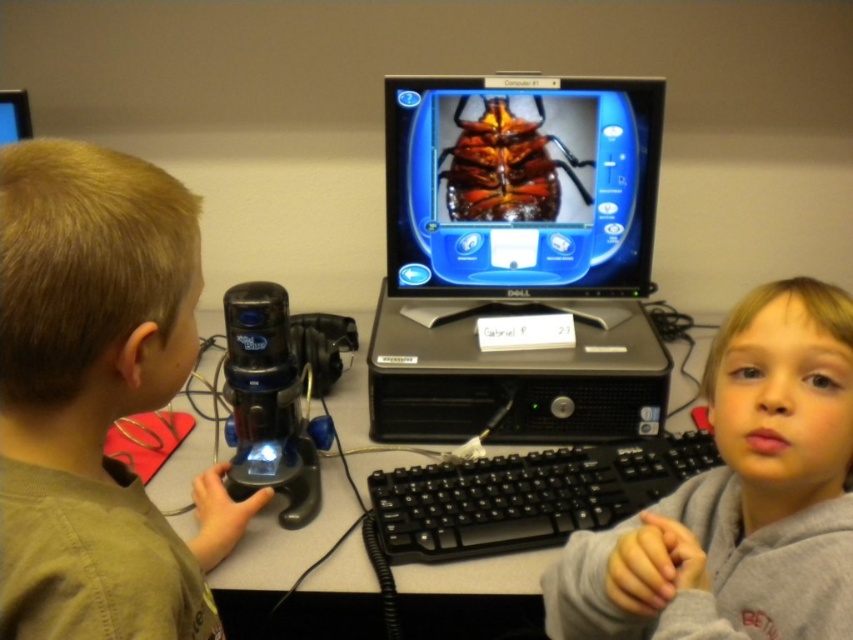
Is point (431, 300) positioned in front of point (444, 497)?

No, it is behind (444, 497).

Is black plastic desktop computer at center above black plastic keyboard at center?

Yes.

This screenshot has height=640, width=853. What do you see at coordinates (518, 257) in the screenshot? I see `black plastic desktop computer at center` at bounding box center [518, 257].

Where is `black plastic desktop computer at center`? black plastic desktop computer at center is located at coordinates (518, 257).

Can you confirm if black plastic keyboard at center is wider than black plastic computer desk at center?

In fact, black plastic keyboard at center might be narrower than black plastic computer desk at center.

Does point (482, 486) lie behind point (694, 397)?

No, (482, 486) is closer to viewer.

Who is more forward, (492, 524) or (351, 525)?

Point (492, 524) is more forward.

I want to click on black plastic keyboard at center, so click(525, 497).

Can you confirm if light brown hair at left is thinner than black plastic computer desk at center?

Yes, light brown hair at left is thinner than black plastic computer desk at center.

Can you confirm if light brown hair at left is positioned to the left of black plastic computer desk at center?

Yes, light brown hair at left is to the left of black plastic computer desk at center.

Is point (6, 547) positioned before point (253, 532)?

Yes, point (6, 547) is closer to viewer.

At what (x,y) coordinates should I click in order to perform the action: click on light brown hair at left. Please return your answer as a coordinate pair (x, y). Looking at the image, I should click on (96, 396).